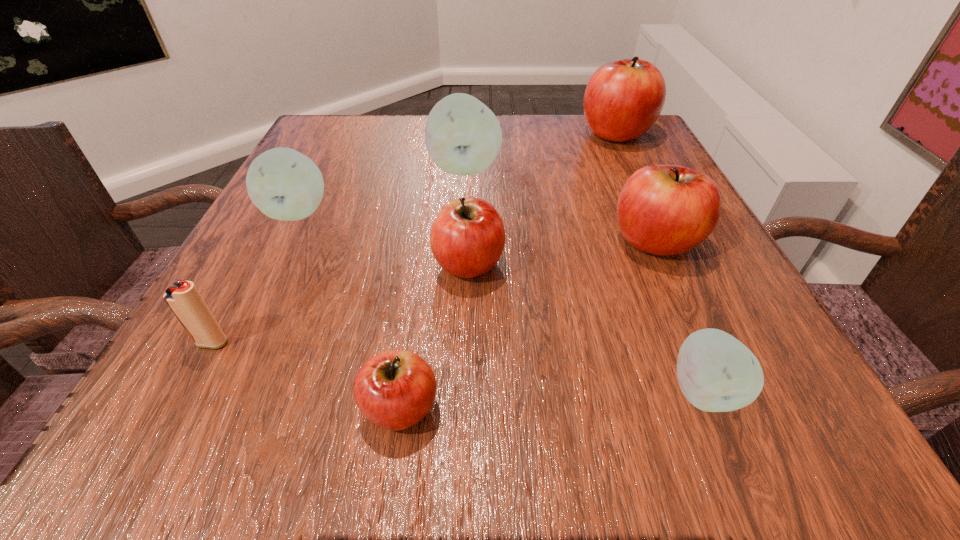
At what (x,y) coordinates should I click in order to perform the action: click on the nearest white apple. Please return your answer as a coordinate pair (x, y). The width and height of the screenshot is (960, 540). Looking at the image, I should click on (716, 372).

Identify the location of the smallest red apple. (394, 390).

What are the coordinates of `vacant space located 0.260m on the left of the biggest red apple` in the screenshot? It's located at (466, 134).

Identify the location of free space located 0.130m on the front of the biggest white apple. The image size is (960, 540). (462, 228).

Where is `vacant space situated on the back of the second biggest red apple`? vacant space situated on the back of the second biggest red apple is located at coordinates coord(618,160).

Where is `free spot located on the front of the second nearest white apple`? This screenshot has width=960, height=540. free spot located on the front of the second nearest white apple is located at coordinates (228, 349).

This screenshot has width=960, height=540. Identify the location of free location located 0.230m on the front of the second smallest red apple. (464, 440).

This screenshot has height=540, width=960. Identify the location of free location located 0.280m on the back of the third nearest object. (283, 213).

Image resolution: width=960 pixels, height=540 pixels. Identify the location of free space located 0.160m on the left of the nearest white apple. (534, 390).

The image size is (960, 540). In order to click on free space located 0.080m on the back of the smallest red apple in this screenshot , I will do `click(412, 328)`.